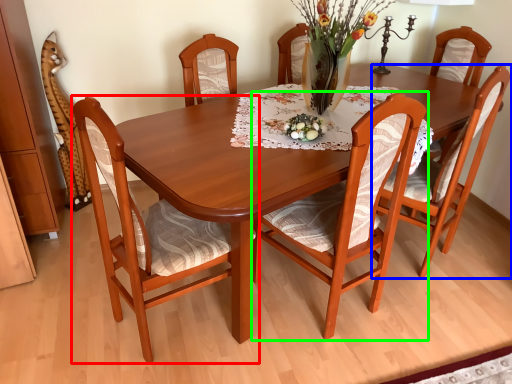
Question: Which is farther away from chair (highlighted by a red box)? chair (highlighted by a blue box) or chair (highlighted by a green box)?

Choices:
 (A) chair
 (B) chair

Answer: (A)